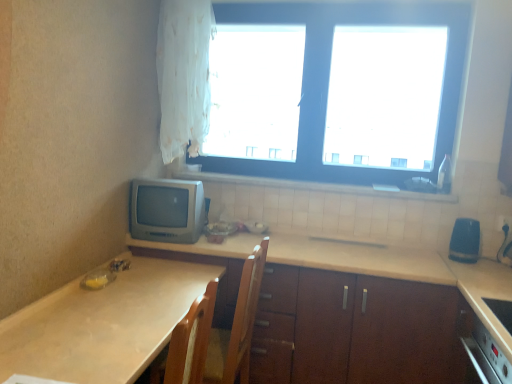
Question: From the image's perspective, is white plastic electric outlet at lower right above or below beige laminate countertop at center, which is counted as the second countertop, starting from the left?

Choices:
 (A) below
 (B) above

Answer: (B)

Question: Is white plastic electric outlet at lower right inside or outside of beige laminate countertop at center, which is counted as the second countertop, starting from the left?

Choices:
 (A) outside
 (B) inside

Answer: (A)

Question: Estimate the real-world distances between objects in this image. Which object is farther from the blue rubber eraser at right, which is the second appliance from left to right?

Choices:
 (A) matte gray crt monitor at left, the second appliance viewed from the right
 (B) white plastic electric outlet at lower right
 (C) white tile at upper center
 (D) beige laminate countertop at center, which is counted as the second countertop, starting from the left
 (E) white plastic window at upper center

Answer: (A)

Question: Which is farther from the blue rubber eraser at right, which is the second appliance from left to right?

Choices:
 (A) white plastic window at upper center
 (B) white plastic electric outlet at lower right
 (C) matte gray crt monitor at left, the second appliance viewed from the right
 (D) beige laminate countertop at center, which is counted as the second countertop, starting from the left
 (E) white sheer curtain at upper left

Answer: (E)